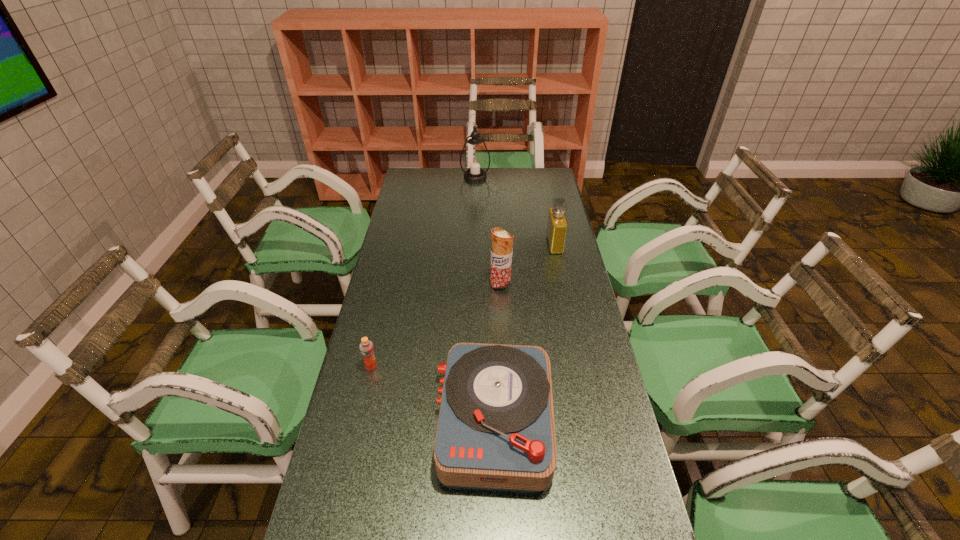
The image size is (960, 540). What are the coordinates of `the farthest object` in the screenshot? It's located at (475, 160).

Identify the location of the tallest object. (475, 160).

Identify the location of burrito. (502, 241).

Image resolution: width=960 pixels, height=540 pixels. I want to click on the third farthest object, so click(x=502, y=241).

Identify the location of perfume. This screenshot has height=540, width=960. (557, 225).

You are a GUI agent. You are given a task and a screenshot of the screen. Output one action in this format:
    pyautogui.click(x=<x>, y=<y>)
    Task: Click on the third tallest object
    The height and width of the screenshot is (540, 960).
    Given the screenshot: What is the action you would take?
    pyautogui.click(x=557, y=225)

Locate an element on the screen. This screenshot has height=540, width=960. record player is located at coordinates (496, 429).

Where is `orange juice`? orange juice is located at coordinates (366, 347).

Identify the location of vacant area located 0.070m on the front of the farthest object. (475, 190).

Identify the location of vacant space located on the front of the third nearest object. (505, 361).